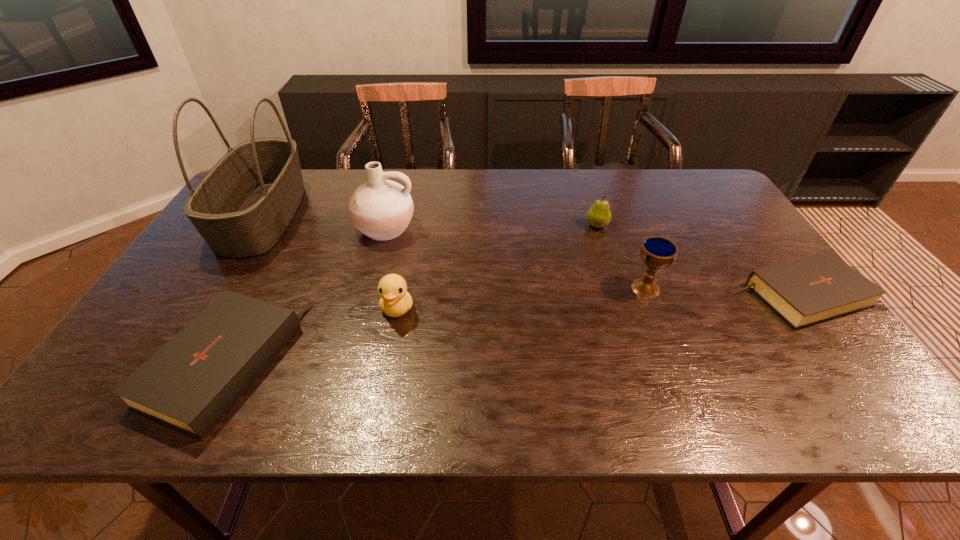
Please point a spot to place another Bible for symmetrical spacing. Please provide its 2D coordinates. Your answer should be formatted as a tuple, i.e. [(x, y)], where the tuple contains the x and y coordinates of a point satisfying the conditions above.

[(532, 327)]